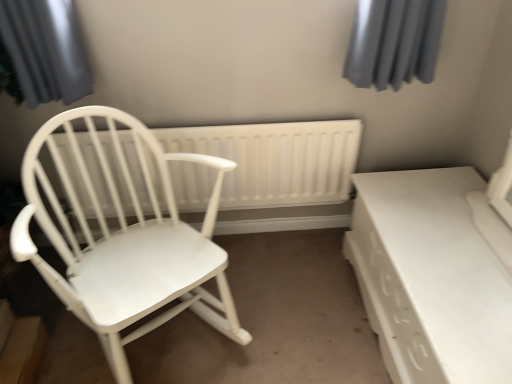
Identify the location of blank space situated above white glossy table at lower right (from a real-world perspective). (452, 235).